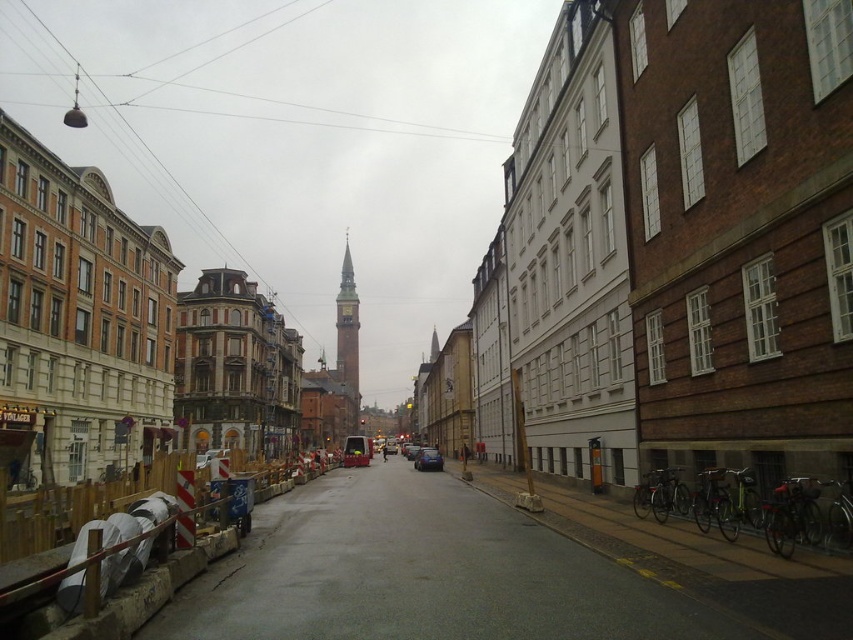
From the picture: You are standing on the narrow urban street scene and want to walk towards the point that is closer to you. Which point should you head towards, point (343,280) or point (416,465)?

You should head towards point (416,465) because it is closer to you than point (343,280) which is further away.

You are a pedestrian standing on the narrow urban street and want to take a photo of the gold textured clock tower at center and the metallic blue car at center. Which object should you focus on first if you want to capture both in a single frame without moving your camera?

The gold textured clock tower at center is above the metallic blue car at center, so you should focus on the metallic blue car at center first to ensure both are in the frame.